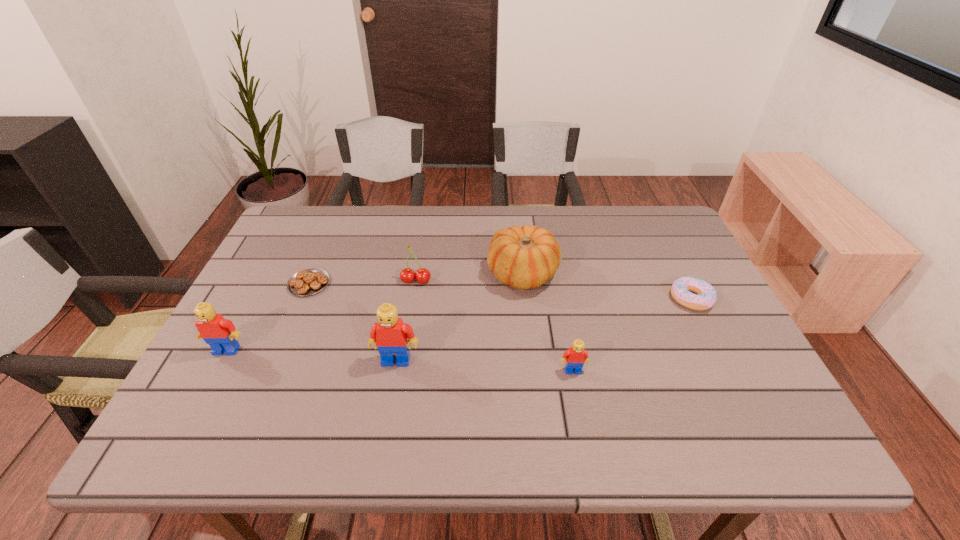
Where is `vacant space that is in between the cherry and the gourd`? vacant space that is in between the cherry and the gourd is located at coordinates (469, 278).

You are a GUI agent. You are given a task and a screenshot of the screen. Output one action in this format:
    pyautogui.click(x=<x>, y=<y>)
    Task: Click on the free area in between the cherry and the pastry
    
    Given the screenshot: What is the action you would take?
    pyautogui.click(x=363, y=282)

Find the location of a particular element. The image size is (960, 540). unoccupied position between the cherry and the second Lego from left to right is located at coordinates (406, 320).

Locate an element on the screen. free spot between the rightmost object and the gourd is located at coordinates point(607,286).

Locate an element on the screen. the closest object to the rightmost Lego is located at coordinates (526, 257).

Identify the location of the second closest object to the second Lego from right to left. click(526, 257).

Image resolution: width=960 pixels, height=540 pixels. In order to click on Lego that stands as the third closest to the gourd in this screenshot , I will do `click(221, 335)`.

Locate which Lego ranks in proximity to the gourd. Please provide its 2D coordinates. Your answer should be formatted as a tuple, i.e. [(x, y)], where the tuple contains the x and y coordinates of a point satisfying the conditions above.

[(576, 356)]